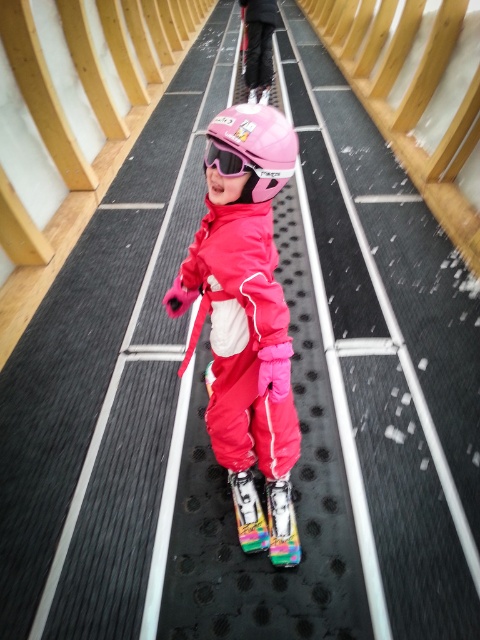
Between point (239, 115) and point (226, 156), which one is positioned behind?

Positioned behind is point (226, 156).

Can you confirm if pink matte helmet at center is taller than pink matte ski goggles at center?

Yes.

Which is in front, point (228, 164) or point (253, 176)?

Point (228, 164) is in front.

This screenshot has height=640, width=480. What are the coordinates of `pink matte helmet at center` in the screenshot? It's located at (x=252, y=148).

Consider the image. Who is higher up, matte black pants at center or pink matte ski goggles at center?

matte black pants at center is above.

Does matte black pants at center appear over pink matte ski goggles at center?

Correct, matte black pants at center is located above pink matte ski goggles at center.

Measure the distance between point (252, 60) and camera.

Point (252, 60) and camera are 4.95 meters apart from each other.

The height and width of the screenshot is (640, 480). I want to click on matte black pants at center, so click(x=259, y=45).

The image size is (480, 640). What do you see at coordinates (240, 264) in the screenshot? I see `matte pink jacket at center` at bounding box center [240, 264].

Between point (216, 272) and point (277, 177), which one is positioned in front?

Point (277, 177)

Which is behind, point (259, 346) or point (225, 168)?

The point (259, 346) is more distant.

Locate an element on the screen. This screenshot has width=480, height=640. matte pink jacket at center is located at coordinates (x=240, y=264).